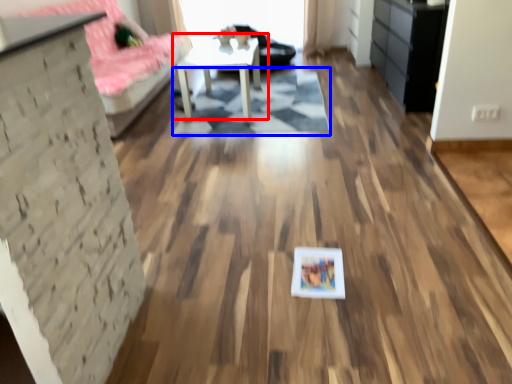
Question: Which of the following is the closest to the observer, table (highlighted by a red box) or mat (highlighted by a blue box)?

Choices:
 (A) table
 (B) mat

Answer: (B)